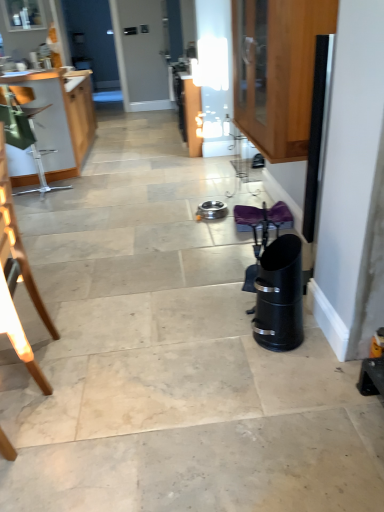
Question: Does wooden cabinet at left, which is the 1th cabinetry from back to front, have a greater width compared to wooden cabinet at upper right, which appears as the 1th cabinetry when viewed from the front?

Choices:
 (A) yes
 (B) no

Answer: (A)

Question: From the image's perspective, is wooden cabinet at left, the 2th cabinetry positioned from the right, on top of wooden cabinet at upper right, which ranks as the 2th cabinetry in left-to-right order?

Choices:
 (A) no
 (B) yes

Answer: (B)

Question: Can you confirm if wooden cabinet at left, the 2th cabinetry positioned from the right, is positioned to the right of wooden cabinet at upper right, which appears as the 1th cabinetry when viewed from the front?

Choices:
 (A) no
 (B) yes

Answer: (A)

Question: Does wooden cabinet at left, which is the first cabinetry in left-to-right order, lie behind wooden cabinet at upper right, placed as the 2th cabinetry when sorted from back to front?

Choices:
 (A) yes
 (B) no

Answer: (A)

Question: Is wooden cabinet at left, which is the first cabinetry in left-to-right order, smaller than wooden cabinet at upper right, placed as the 2th cabinetry when sorted from back to front?

Choices:
 (A) no
 (B) yes

Answer: (A)

Question: Is point (4, 187) positioned closer to the camera than point (248, 130)?

Choices:
 (A) closer
 (B) farther

Answer: (A)

Question: Is wooden chair at left bigger or smaller than wooden cabinet at upper right, which appears as the 1th cabinetry when viewed from the front?

Choices:
 (A) small
 (B) big

Answer: (A)

Question: Considering the relative positions of wooden chair at left and wooden cabinet at upper right, which ranks as the 2th cabinetry in left-to-right order, in the image provided, is wooden chair at left to the left or to the right of wooden cabinet at upper right, which ranks as the 2th cabinetry in left-to-right order,?

Choices:
 (A) right
 (B) left

Answer: (B)

Question: From the image's perspective, is wooden chair at left above or below wooden cabinet at upper right, placed as the 2th cabinetry when sorted from back to front?

Choices:
 (A) below
 (B) above

Answer: (A)

Question: From a real-world perspective, is wooden cabinet at upper right, positioned as the 1th cabinetry in right-to-left order, above or below wooden cabinet at left, which is the first cabinetry in left-to-right order?

Choices:
 (A) above
 (B) below

Answer: (A)

Question: Based on their sizes in the image, would you say wooden cabinet at upper right, placed as the 2th cabinetry when sorted from back to front, is bigger or smaller than wooden cabinet at left, which is the first cabinetry in left-to-right order?

Choices:
 (A) big
 (B) small

Answer: (B)

Question: Is wooden cabinet at upper right, which ranks as the 2th cabinetry in left-to-right order, to the left or to the right of wooden cabinet at left, the 2th cabinetry positioned from the right, in the image?

Choices:
 (A) left
 (B) right

Answer: (B)

Question: From the image's perspective, is wooden cabinet at upper right, which appears as the 1th cabinetry when viewed from the front, located above or below wooden cabinet at left, the 2th cabinetry positioned from the right?

Choices:
 (A) above
 (B) below

Answer: (B)

Question: From a real-world perspective, is wooden chair at left above or below wooden cabinet at left, acting as the 2th cabinetry starting from the front?

Choices:
 (A) above
 (B) below

Answer: (B)

Question: From their relative heights in the image, would you say wooden chair at left is taller or shorter than wooden cabinet at left, the 2th cabinetry positioned from the right?

Choices:
 (A) short
 (B) tall

Answer: (B)